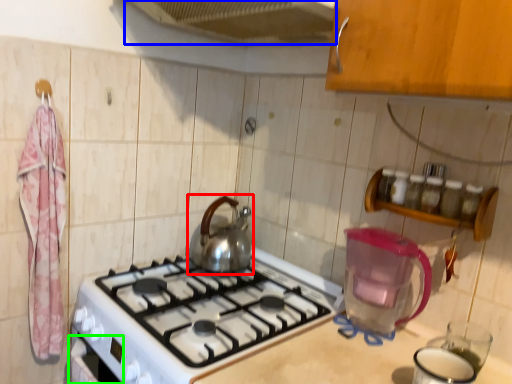
Question: Considering the real-world distances, which object is farthest from kettle (highlighted by a red box)? exhaust hood (highlighted by a blue box) or oven (highlighted by a green box)?

Choices:
 (A) exhaust hood
 (B) oven

Answer: (A)